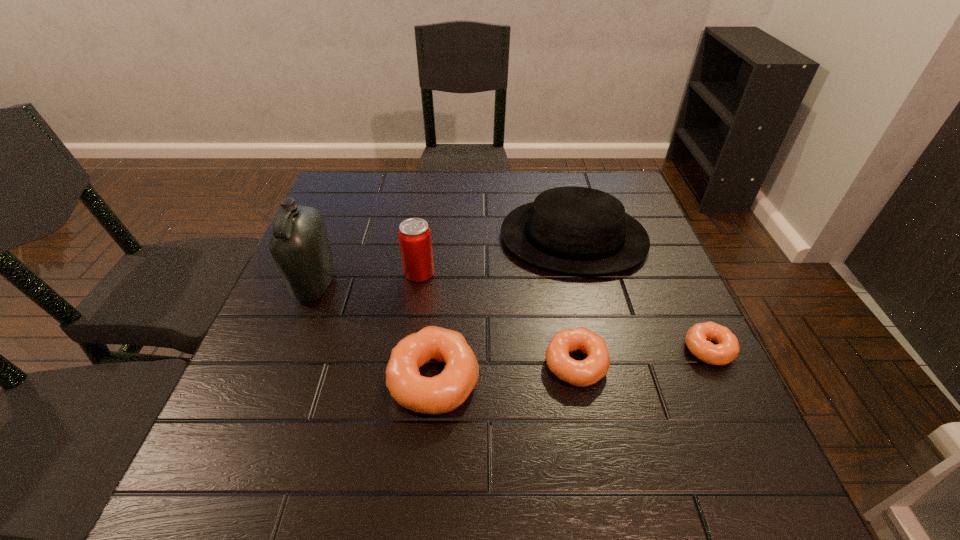
In the current image, all doughnuts are evenly spaced. To maintain this equal spacing, where should an additional doughnut be placed on the left? Please point out a free spot. Please provide its 2D coordinates. Your answer should be formatted as a tuple, i.e. [(x, y)], where the tuple contains the x and y coordinates of a point satisfying the conditions above.

[(283, 396)]